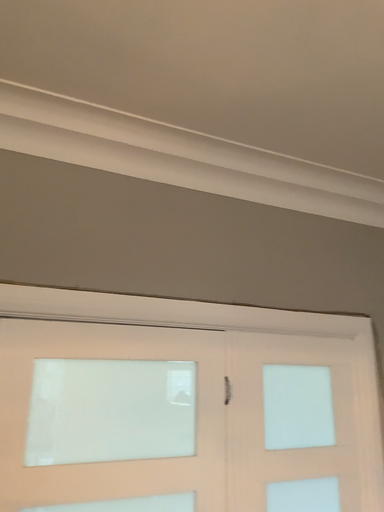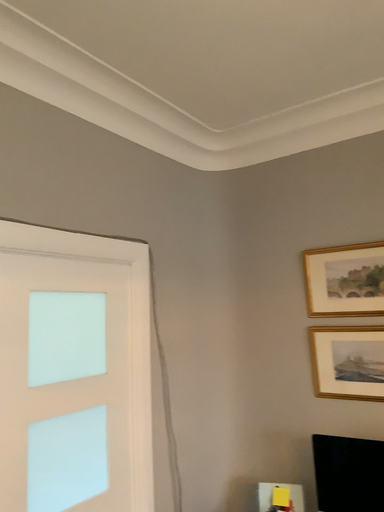
Question: Which way did the camera rotate in the video?

Choices:
 (A) rotated downward
 (B) rotated upward

Answer: (A)